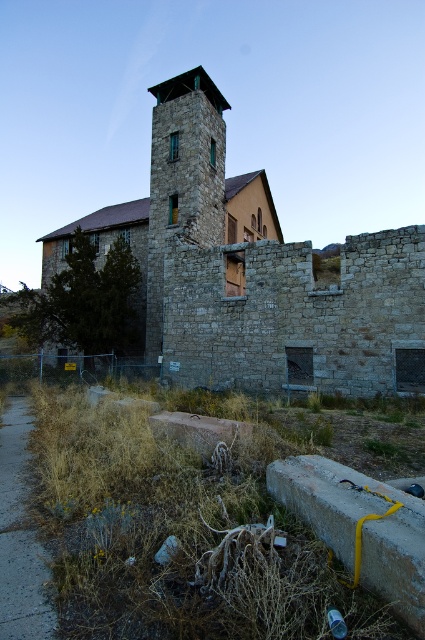
Question: Which point appears farthest from the camera in this image?

Choices:
 (A) (215, 100)
 (B) (223, 362)

Answer: (A)

Question: Does stone brick fort at center come behind stone tower at center?

Choices:
 (A) yes
 (B) no

Answer: (B)

Question: Is stone brick fort at center positioned at the back of stone tower at center?

Choices:
 (A) no
 (B) yes

Answer: (A)

Question: Which of the following is the closest to the observer?

Choices:
 (A) stone brick fort at center
 (B) stone tower at center

Answer: (A)

Question: Can you confirm if stone brick fort at center is smaller than stone tower at center?

Choices:
 (A) no
 (B) yes

Answer: (A)